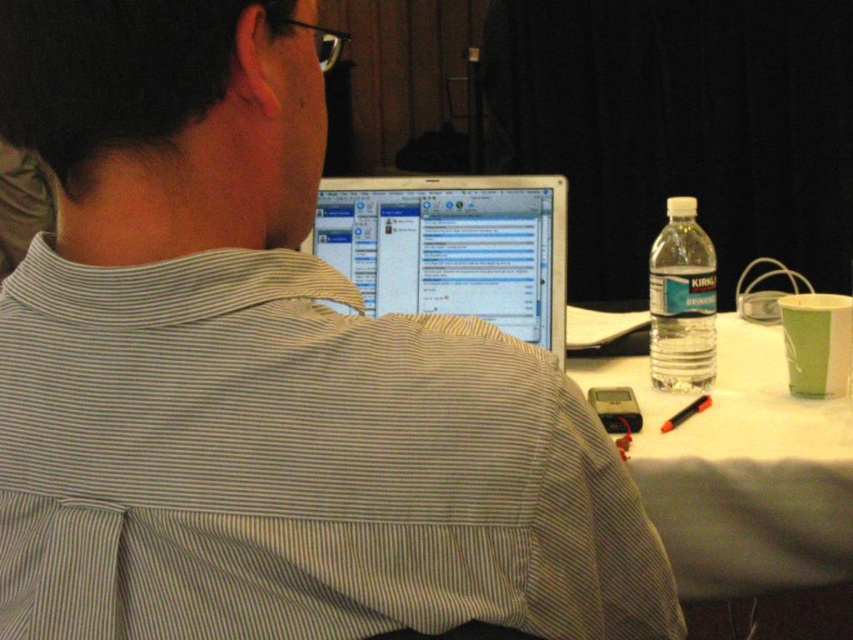
Which is more to the left, shiny silver laptop at center or clear plastic water bottle at right?

shiny silver laptop at center

From the picture: Does shiny silver laptop at center appear under clear plastic water bottle at right?

No, shiny silver laptop at center is not below clear plastic water bottle at right.

Consider the image. Measure the distance between shiny silver laptop at center and camera.

A distance of 4.31 feet exists between shiny silver laptop at center and camera.

Where is `shiny silver laptop at center`? This screenshot has width=853, height=640. shiny silver laptop at center is located at coordinates (451, 248).

Does point (827, 497) come behind point (657, 321)?

No, (827, 497) is in front of (657, 321).

This screenshot has width=853, height=640. In order to click on white paper at center in this screenshot , I will do `click(741, 470)`.

Between point (780, 467) and point (712, 275), which one is positioned behind?

Point (712, 275)

Image resolution: width=853 pixels, height=640 pixels. I want to click on white paper at center, so click(741, 470).

Can you confirm if white paper at center is wider than shiny silver laptop at center?

Yes.

Which is in front, point (700, 515) or point (538, 227)?

Point (700, 515) is in front.

Which is in front, point (825, 545) or point (396, 305)?

Point (825, 545) is in front.

This screenshot has width=853, height=640. Find the location of `white paper at center`. white paper at center is located at coordinates (741, 470).